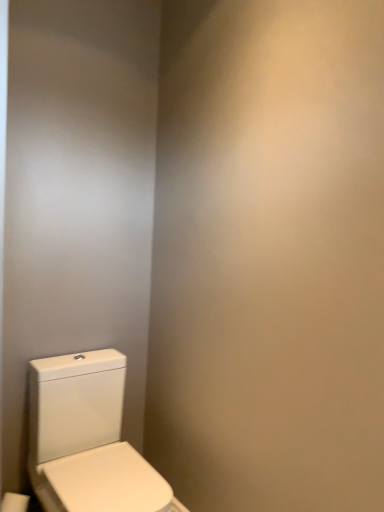
What do you see at coordinates (87, 438) in the screenshot?
I see `white glossy toilet at lower left` at bounding box center [87, 438].

This screenshot has width=384, height=512. In order to click on white glossy toilet at lower left in this screenshot , I will do `click(87, 438)`.

This screenshot has width=384, height=512. What are the coordinates of `white glossy toilet at lower left` in the screenshot? It's located at (87, 438).